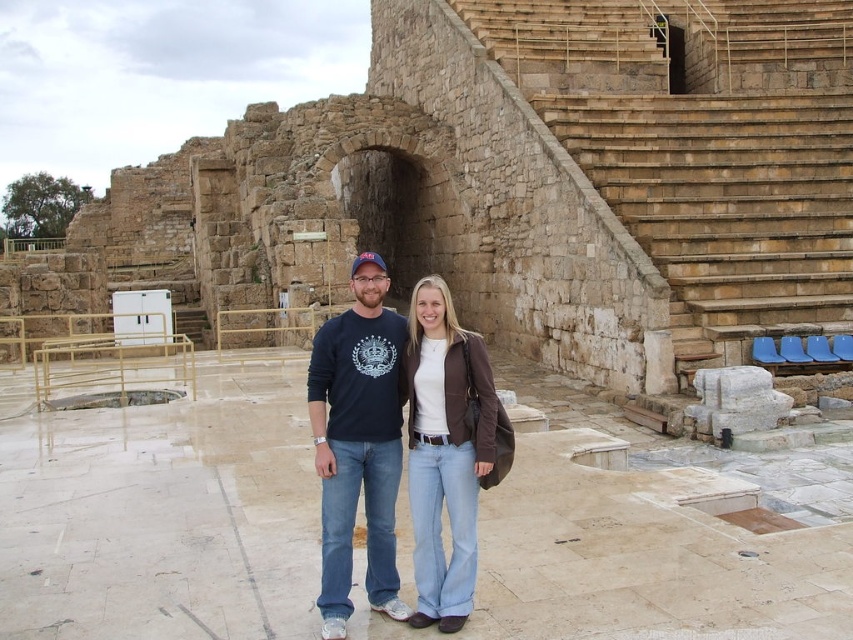
Is point (322, 464) positioned after point (416, 429)?

That is False.

Is point (329, 515) positioned behind point (456, 609)?

Yes, point (329, 515) is farther from viewer.

This screenshot has height=640, width=853. In order to click on matte blue sweatshirt at center in this screenshot , I will do `click(363, 433)`.

Does brown stone stairs at upper right have a greater width compared to matte blue sweatshirt at center?

Correct, the width of brown stone stairs at upper right exceeds that of matte blue sweatshirt at center.

Which is more to the right, brown stone stairs at upper right or matte blue sweatshirt at center?

brown stone stairs at upper right is more to the right.

Is point (587, 22) behind point (323, 536)?

That is True.

Find the location of `brown stone stairs at upper right`. brown stone stairs at upper right is located at coordinates (703, 145).

Does brown stone stairs at upper right have a larger size compared to brown leather jacket at center?

Yes, brown stone stairs at upper right is bigger than brown leather jacket at center.

At what (x,y) coordinates should I click in order to perform the action: click on brown stone stairs at upper right. Please return your answer as a coordinate pair (x, y). The width and height of the screenshot is (853, 640). Looking at the image, I should click on (703, 145).

This screenshot has height=640, width=853. What do you see at coordinates (703, 145) in the screenshot?
I see `brown stone stairs at upper right` at bounding box center [703, 145].

Identify the location of brown stone stairs at upper right. Image resolution: width=853 pixels, height=640 pixels. (703, 145).